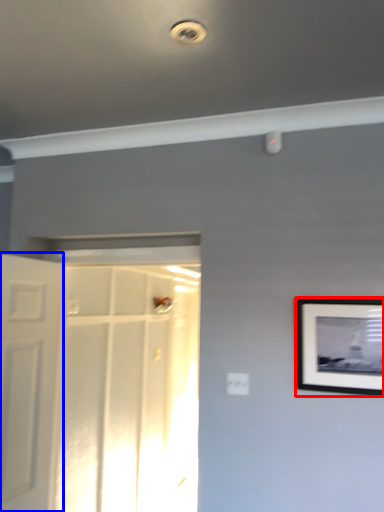
Question: Which object is closer to the camera taking this photo, picture frame (highlighted by a red box) or door (highlighted by a blue box)?

Choices:
 (A) picture frame
 (B) door

Answer: (A)